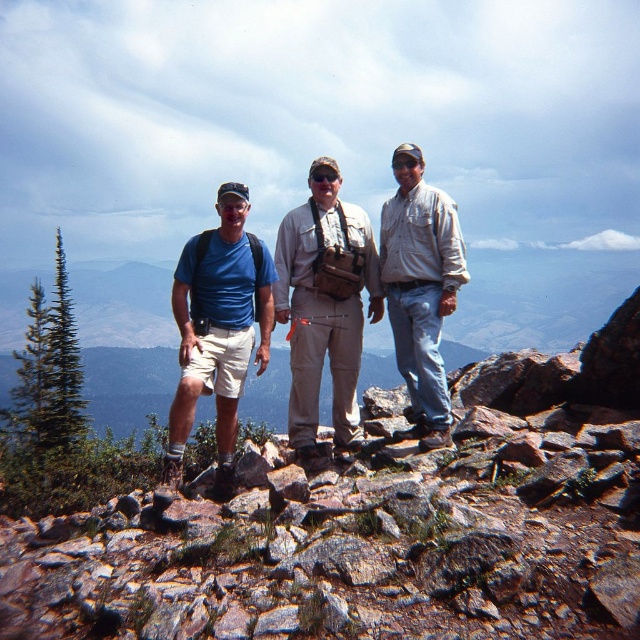
Looking at this image, does matte blue t-shirt at center have a lesser width compared to matte blue shirt at center?

Correct, matte blue t-shirt at center's width is less than matte blue shirt at center's.

Which is more to the left, matte blue t-shirt at center or matte blue shirt at center?

matte blue shirt at center is more to the left.

Identify the location of matte blue t-shirt at center. Image resolution: width=640 pixels, height=640 pixels. (358, 296).

Between khaki cotton pants at center and light brown shirt at center, which one appears on the right side from the viewer's perspective?

light brown shirt at center is more to the right.

Who is shorter, khaki cotton pants at center or light brown shirt at center?

With less height is light brown shirt at center.

This screenshot has height=640, width=640. Find the location of `khaki cotton pants at center`. khaki cotton pants at center is located at coordinates (324, 305).

Between matte blue t-shirt at center and light brown shirt at center, which one is positioned lower?

Positioned lower is matte blue t-shirt at center.

Is point (225, 403) in front of point (444, 442)?

No.

Is point (410, 236) positioned before point (403, 288)?

Yes, it is in front of point (403, 288).

This screenshot has height=640, width=640. What are the coordinates of `matte blue t-shirt at center` in the screenshot? It's located at (358, 296).